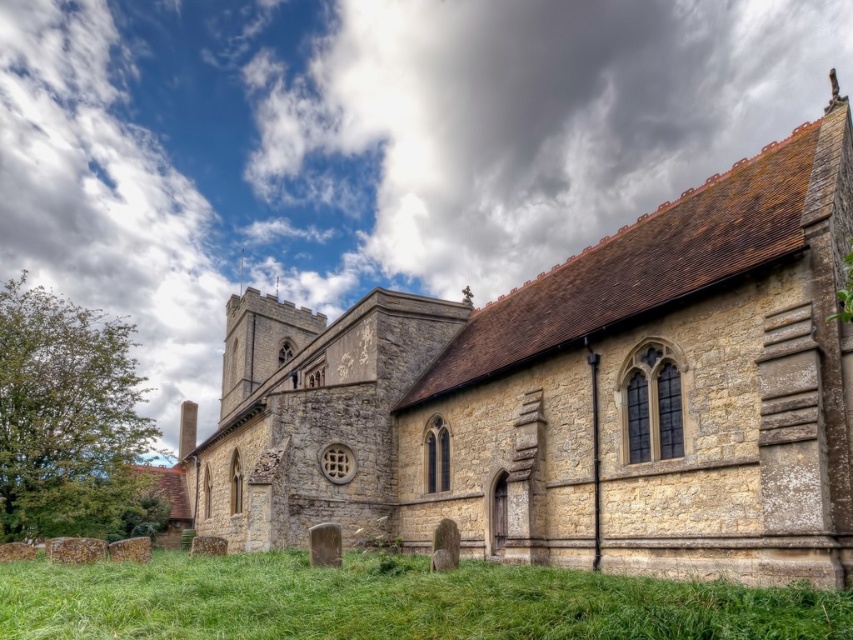
Question: Which is farther from the green grass at lower center?

Choices:
 (A) cloudy sky at upper center
 (B) stone church at center

Answer: (A)

Question: Observing the image, what is the correct spatial positioning of stone church at center in reference to green grass at lower center?

Choices:
 (A) right
 (B) left

Answer: (A)

Question: Is stone church at center behind cloudy sky at upper center?

Choices:
 (A) no
 (B) yes

Answer: (A)

Question: In this image, where is stone church at center located relative to cloudy sky at upper center?

Choices:
 (A) below
 (B) above

Answer: (A)

Question: Which object is farther from the camera taking this photo?

Choices:
 (A) cloudy sky at upper center
 (B) stone church at center
 (C) green grass at lower center

Answer: (A)

Question: Considering the real-world distances, which object is closest to the cloudy sky at upper center?

Choices:
 (A) green grass at lower center
 (B) stone church at center

Answer: (B)